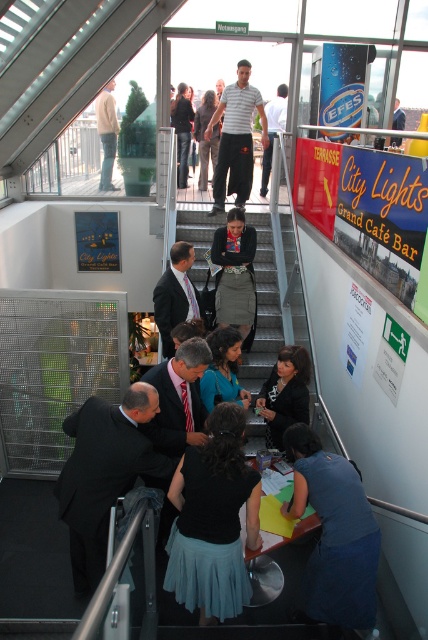
You are standing at the point labeled point (195, 312) and want to move towards the point labeled point (207, 188). Given that you can only move forward in a straight line, will you be moving towards or away from the camera?

Since point (195, 312) is closer to the camera than point (207, 188), moving towards point (207, 188) from point (195, 312) would mean moving away from the camera.

You are a person standing at point (270, 132) and want to reach the nearest exit. The nearest exit is located at the point that is 8.27 meters away from your current position. Can you estimate how far you need to walk to reach the exit?

The nearest exit is located at the point that is 8.27 meters away from your current position at point (270, 132), so you need to walk 8.27 meters to reach the exit.